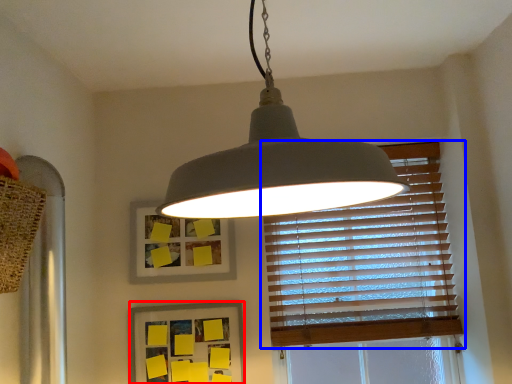
Question: Which of the following is the farthest to the observer, picture frame (highlighted by a red box) or window blind (highlighted by a blue box)?

Choices:
 (A) picture frame
 (B) window blind

Answer: (B)